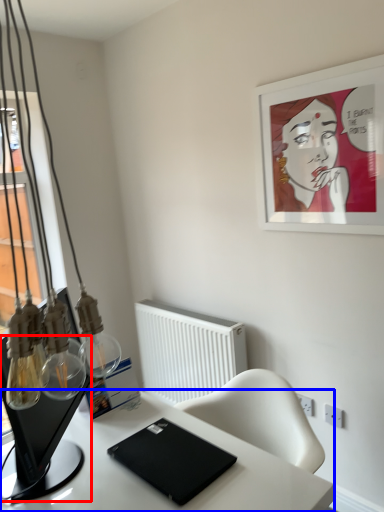
Question: Which object appears closest to the camera in this image, computer monitor (highlighted by a red box) or desk (highlighted by a blue box)?

Choices:
 (A) computer monitor
 (B) desk

Answer: (A)